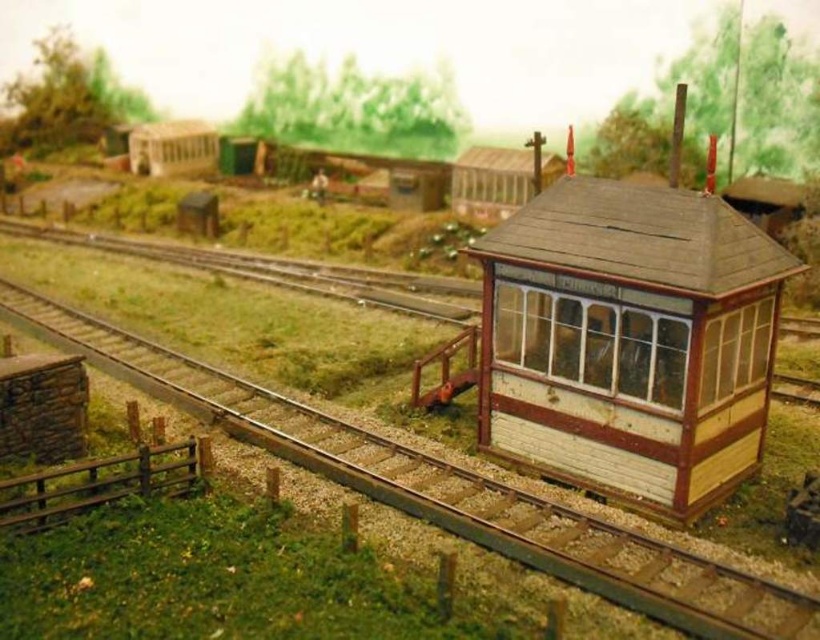
You are standing at the origin point of the model railway scene. You want to place a new decorative tree exactly at point (x=623, y=339). However, there is already an object there. What object is located at that point?

The wooden signal box at right is located at point (x=623, y=339).

You are standing at the center of the image. Which direction should you move to reach the wooden signal box at right?

Since the wooden signal box at right is located at coordinates approximately 0.531 on the x axis and 0.762 on the y axis, you should move to the right and slightly upwards to reach it from the center.